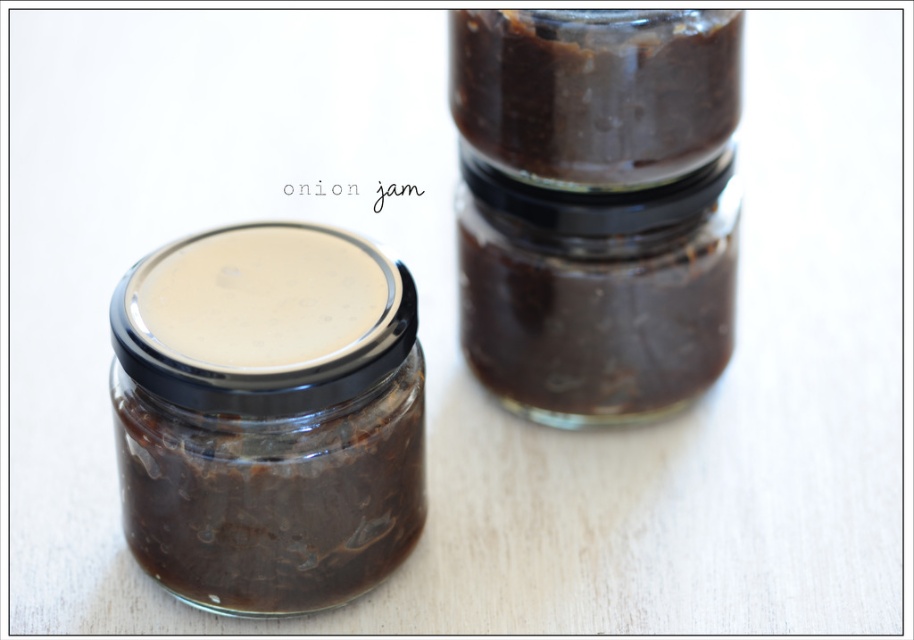
Is dark brown glass jar at center in front of matte glass jar at left?

That is False.

Is dark brown glass jar at center positioned behind matte glass jar at left?

Yes, dark brown glass jar at center is further from the viewer.

Who is more forward, (519, 44) or (258, 266)?

Point (258, 266) is more forward.

Locate an element on the screen. dark brown glass jar at center is located at coordinates (596, 205).

Who is taller, matte glass jar at left or dark brown glass jar at upper center?

matte glass jar at left is taller.

Which is in front, point (351, 522) or point (624, 144)?

Positioned in front is point (351, 522).

Identify the location of matte glass jar at left. (268, 417).

Who is more distant from viewer, (703, 157) or (659, 116)?

Point (703, 157)

Does dark brown glass jar at center appear over dark brown glass jar at upper center?

No.

The width and height of the screenshot is (914, 640). I want to click on dark brown glass jar at center, so click(x=596, y=205).